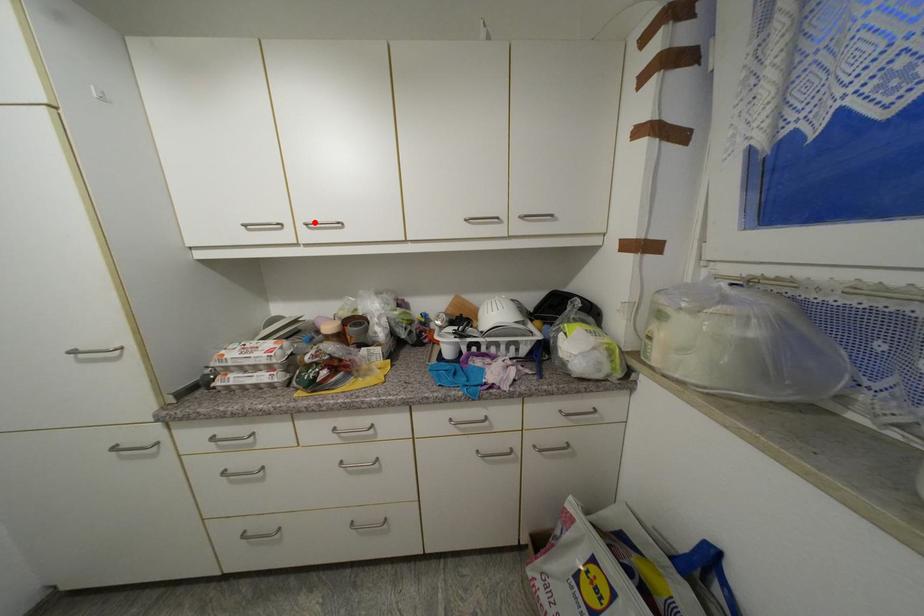
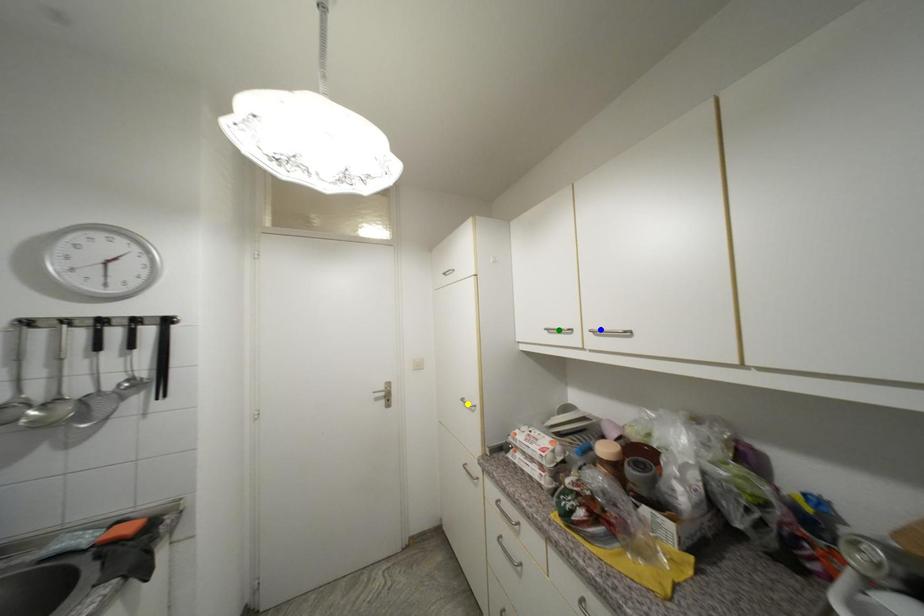
Question: I am providing you with two images of the same scene from different viewpoints. A red point is marked on the first image. You are given multiple points on the second image. In image 2, which mark is for the same physical point as the one in image 1?

Choices:
 (A) blue point
 (B) green point
 (C) yellow point

Answer: (A)